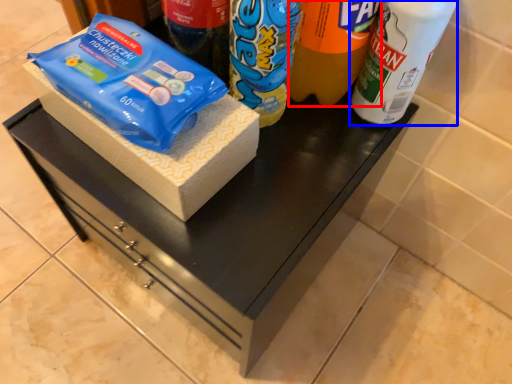
Question: Which point is further to the camera, drinking straw (highlighted by a red box) or bottle (highlighted by a blue box)?

Choices:
 (A) drinking straw
 (B) bottle

Answer: (B)